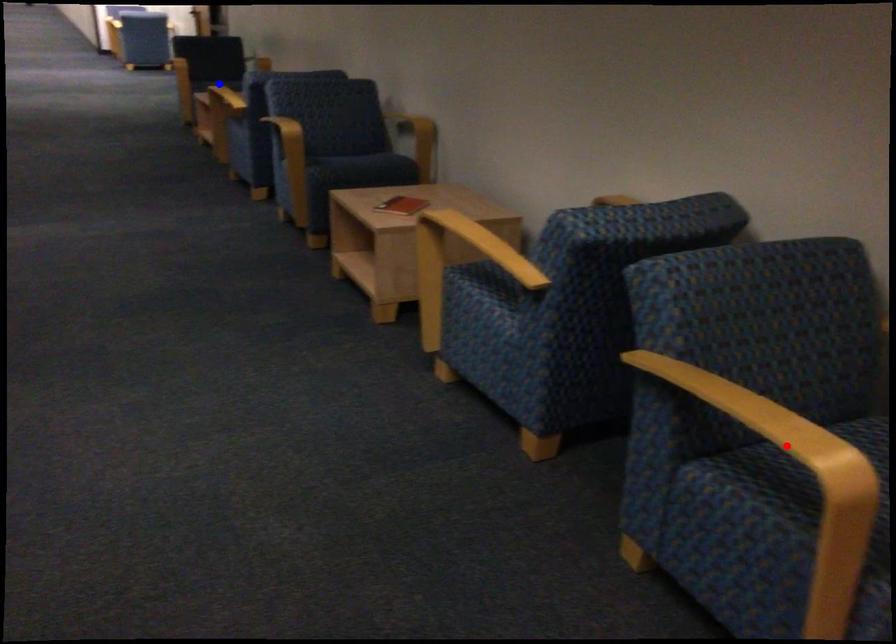
Question: Which of the two points in the image is closer to the camera?

Choices:
 (A) Blue point is closer.
 (B) Red point is closer.

Answer: (B)